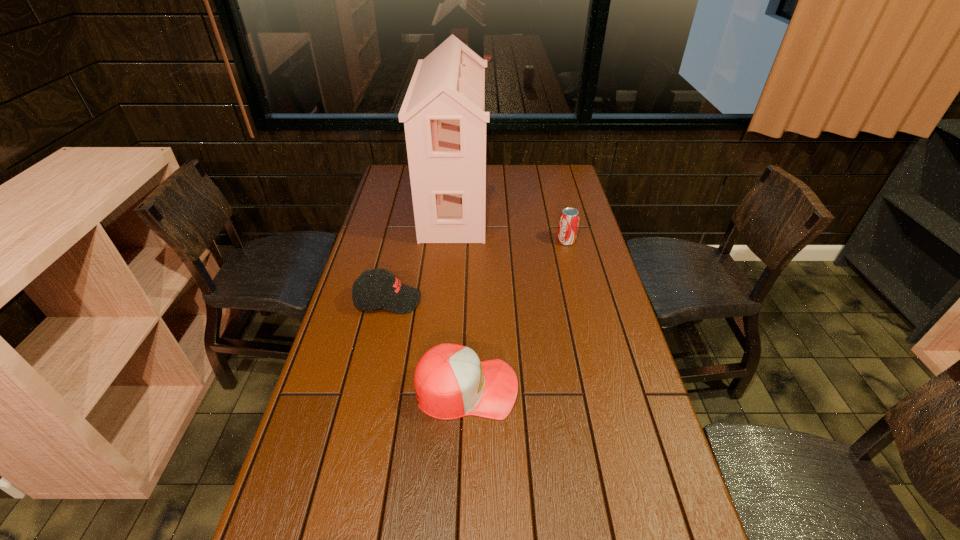
In order to click on empty space that is in between the right baseball cap and the dollhouse in this screenshot , I will do `click(461, 295)`.

Where is `empty space between the tallest object and the rightmost object`? The image size is (960, 540). empty space between the tallest object and the rightmost object is located at coordinates (510, 222).

Locate an element on the screen. vacant point located between the second nearest object and the rightmost object is located at coordinates (477, 271).

At what (x,y) coordinates should I click in order to perform the action: click on free space between the rightmost object and the farther baseball cap. Please return your answer as a coordinate pair (x, y). Looking at the image, I should click on (477, 271).

Find the location of a particular element. The height and width of the screenshot is (540, 960). vacant area that lies between the soda can and the tallest object is located at coordinates (510, 222).

Find the location of a particular element. This screenshot has height=540, width=960. free space between the nearer baseball cap and the farther baseball cap is located at coordinates (427, 345).

Identify the location of object that is the second closest to the right baseball cap. This screenshot has width=960, height=540. (443, 112).

Identify which object is the second nearest to the nearer baseball cap. Please provide its 2D coordinates. Your answer should be formatted as a tuple, i.e. [(x, y)], where the tuple contains the x and y coordinates of a point satisfying the conditions above.

[(443, 112)]

The height and width of the screenshot is (540, 960). Identify the location of baseball cap that stands as the second closest to the tallest object. (450, 381).

I want to click on free spot that satisfies the following two spatial constraints: 1. on the front-facing side of the dollhouse; 2. on the left side of the soda can, so click(451, 241).